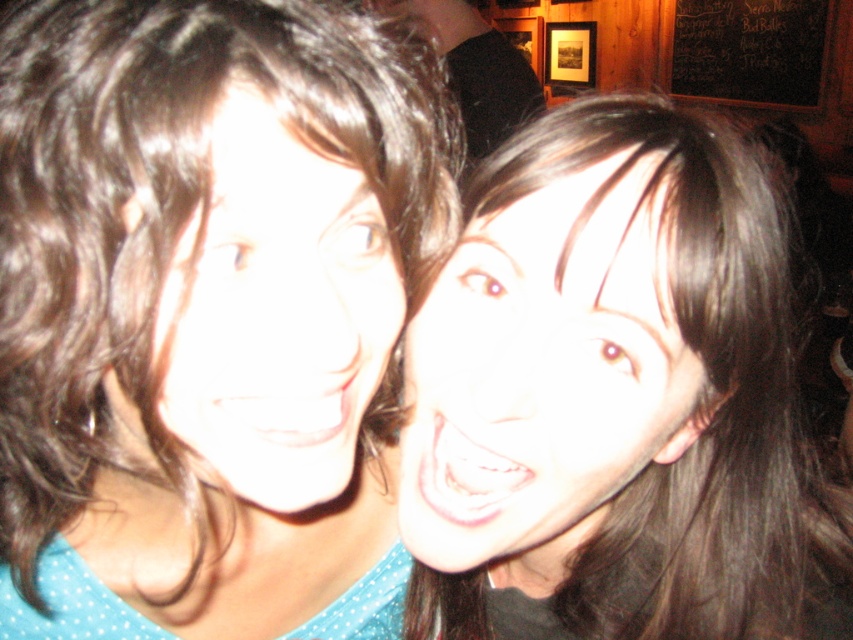
Which is below, smooth skin face at center or matte skin face at center?

smooth skin face at center is lower down.

Is smooth skin face at center below matte skin face at center?

Correct, smooth skin face at center is located below matte skin face at center.

Locate an element on the screen. This screenshot has width=853, height=640. smooth skin face at center is located at coordinates (543, 378).

The height and width of the screenshot is (640, 853). What do you see at coordinates (207, 314) in the screenshot?
I see `smooth brown hair at center` at bounding box center [207, 314].

Which is more to the left, smooth brown hair at center or matte skin face at center?

smooth brown hair at center is more to the left.

Does point (421, 237) lie behind point (183, 276)?

Yes, point (421, 237) is farther from viewer.

Where is `smooth brown hair at center`? smooth brown hair at center is located at coordinates (207, 314).

Does smooth brown hair at center have a larger size compared to smooth skin face at center?

Indeed, smooth brown hair at center has a larger size compared to smooth skin face at center.

Is point (448, 150) closer to camera compared to point (426, 413)?

No, it is not.

The height and width of the screenshot is (640, 853). In order to click on smooth brown hair at center in this screenshot , I will do `click(207, 314)`.